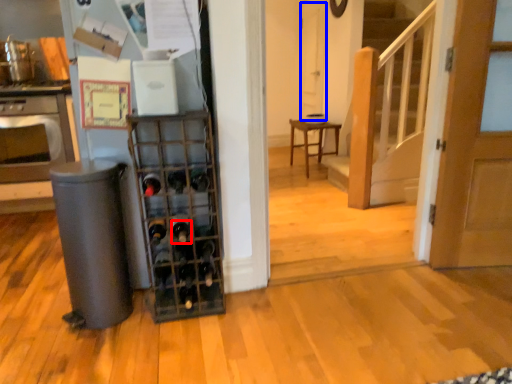
Question: Which object appears farthest to the camera in this image, wine bottle (highlighted by a red box) or screen door (highlighted by a blue box)?

Choices:
 (A) wine bottle
 (B) screen door

Answer: (B)